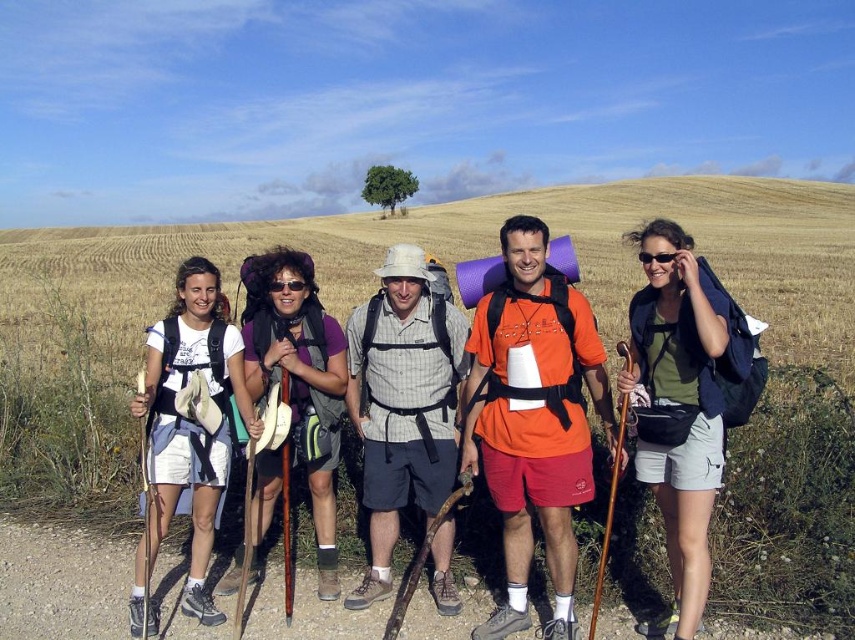
Can you confirm if orange fabric shirt at center is taller than white fabric backpack at left?

Yes, orange fabric shirt at center is taller than white fabric backpack at left.

Does orange fabric shirt at center appear on the left side of white fabric backpack at left?

In fact, orange fabric shirt at center is to the right of white fabric backpack at left.

Between point (535, 243) and point (163, 474), which one is positioned behind?

The point (163, 474) is behind.

You are a GUI agent. You are given a task and a screenshot of the screen. Output one action in this format:
    pyautogui.click(x=<x>, y=<y>)
    Task: Click on the orange fabric shirt at center
    The height and width of the screenshot is (640, 855).
    Given the screenshot: What is the action you would take?
    pyautogui.click(x=534, y=419)

Which is in front, point (644, 380) or point (134, 593)?

Positioned in front is point (644, 380).

Between green fabric backpack at center and white fabric backpack at left, which one is positioned higher?

Positioned higher is green fabric backpack at center.

Describe the element at coordinates (676, 408) in the screenshot. I see `green fabric backpack at center` at that location.

I want to click on green fabric backpack at center, so click(x=676, y=408).

In the scene shown: Between plaid fabric shirt at center and matte purple shirt at center, which one appears on the right side from the viewer's perspective?

From the viewer's perspective, plaid fabric shirt at center appears more on the right side.

Looking at this image, does plaid fabric shirt at center come behind matte purple shirt at center?

No, plaid fabric shirt at center is closer to the viewer.

Does point (417, 396) come in front of point (298, 268)?

Yes, it is in front of point (298, 268).

Image resolution: width=855 pixels, height=640 pixels. I want to click on plaid fabric shirt at center, so click(402, 403).